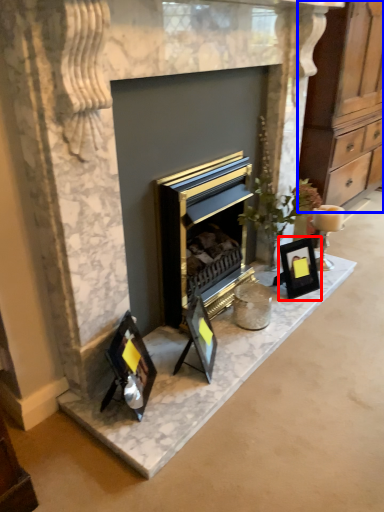
Question: Which point is further to the camera, picture frame (highlighted by a red box) or dresser (highlighted by a blue box)?

Choices:
 (A) picture frame
 (B) dresser

Answer: (B)